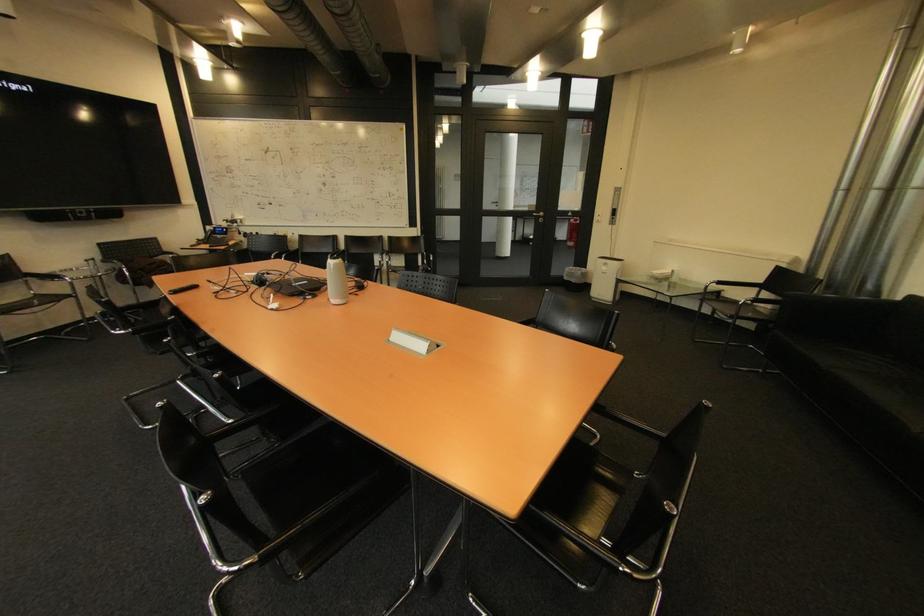
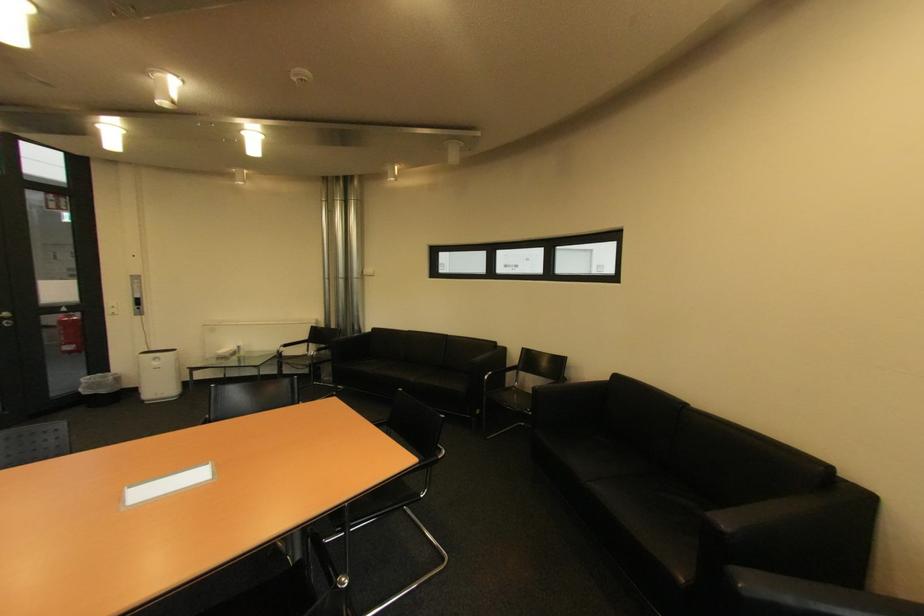
Locate, in the second image, the point that corresponds to [574,280] in the first image.

(94, 394)